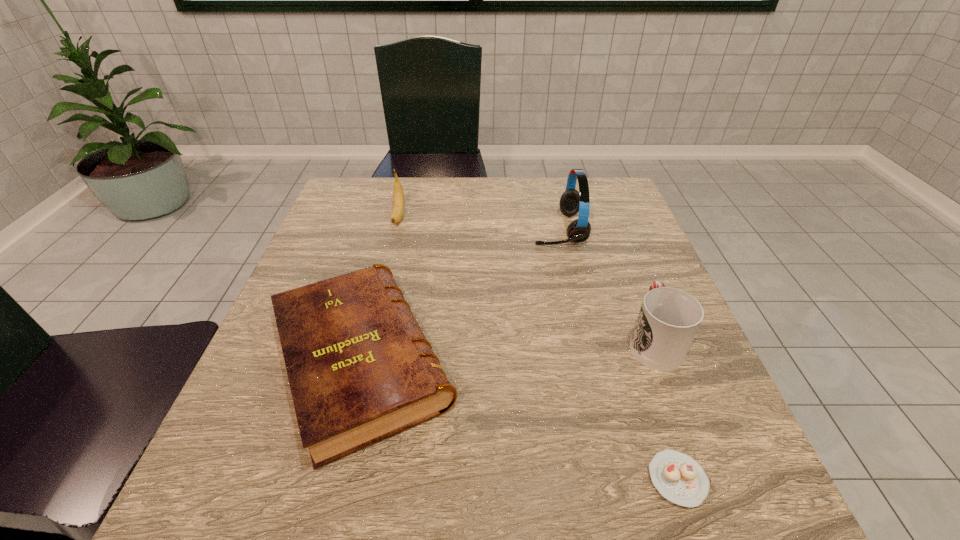
You are a GUI agent. You are given a task and a screenshot of the screen. Output one action in this format:
    pyautogui.click(x=<x>, y=<y>)
    Task: Click on the unoccupied area between the cup and the fourth tallest object
    The width and height of the screenshot is (960, 540).
    Given the screenshot: What is the action you would take?
    pyautogui.click(x=507, y=351)

This screenshot has height=540, width=960. What are the coordinates of `free space that is in between the headset and the hardback book` in the screenshot? It's located at (460, 295).

Find the location of a particular element. Image resolution: width=960 pixels, height=540 pixels. empty space between the headset and the cupcake is located at coordinates (618, 354).

The height and width of the screenshot is (540, 960). I want to click on unoccupied position between the cup and the banana, so click(x=526, y=279).

This screenshot has width=960, height=540. What are the coordinates of `unoccupied position between the cup and the fourth tallest object` in the screenshot? It's located at 507,351.

You are a GUI agent. You are given a task and a screenshot of the screen. Output one action in this format:
    pyautogui.click(x=<x>, y=<y>)
    Task: Click on the vacant area that lies between the shortest object and the cup
    This screenshot has height=540, width=960.
    Given the screenshot: What is the action you would take?
    tap(665, 410)

At what (x,y) coordinates should I click in order to perform the action: click on free space between the shortest object and the hardback book. Please return your answer as a coordinate pair (x, y). This screenshot has height=540, width=960. Looking at the image, I should click on (519, 420).

Locate an element on the screen. Image resolution: width=960 pixels, height=540 pixels. free space that is in between the banana and the headset is located at coordinates (478, 223).

Identify the location of free point between the hardback book and the cupcake. (519, 420).

The width and height of the screenshot is (960, 540). In order to click on empty space between the second shortest object and the cup in this screenshot , I will do `click(507, 351)`.